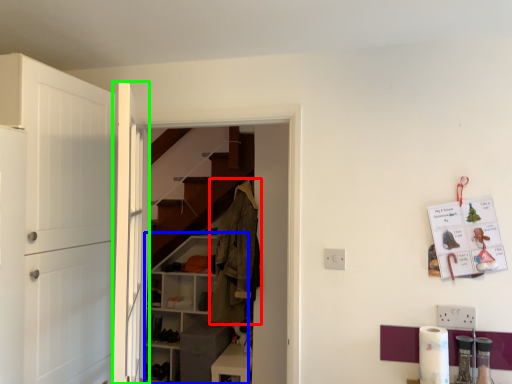
Question: Which object is positioned farthest from clothing (highlighted by a red box)? Select from cabinetry (highlighted by a blue box) and door (highlighted by a green box).

Choices:
 (A) cabinetry
 (B) door

Answer: (B)